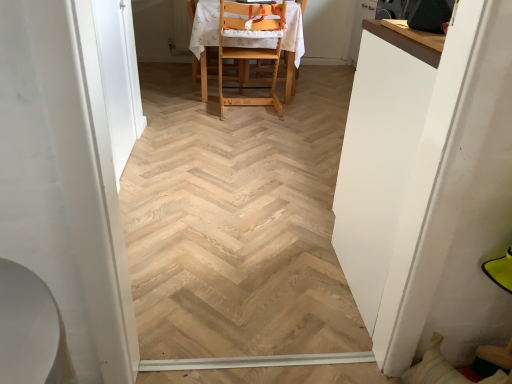
Locate an element on the screen. The height and width of the screenshot is (384, 512). vacant position to the left of white glossy table at right is located at coordinates (285, 271).